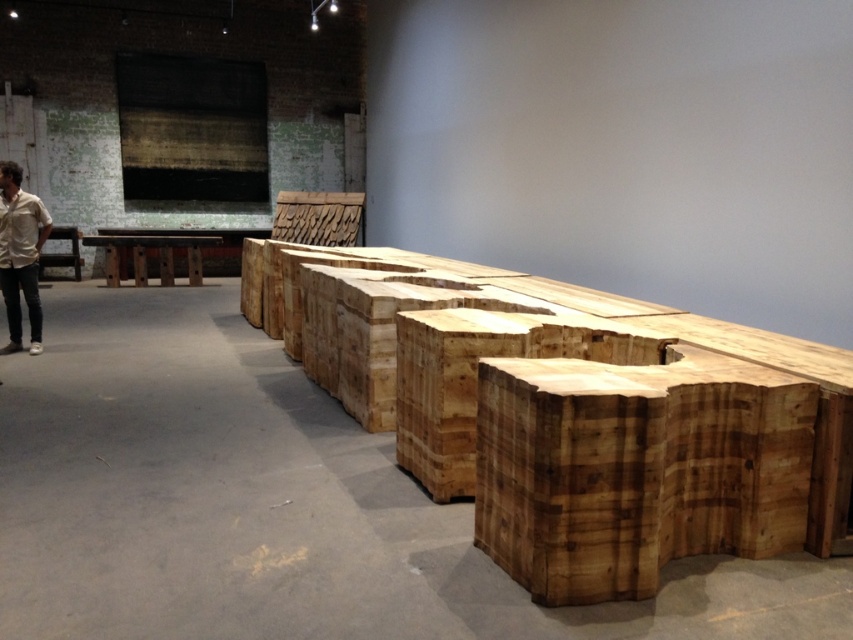
Question: Which object appears closest to the camera in this image?

Choices:
 (A) wooden bench at left
 (B) white shirt at left
 (C) natural wood table at center

Answer: (B)

Question: Is natural wood bench at center behind wooden bench at left?

Choices:
 (A) yes
 (B) no

Answer: (B)

Question: Among these objects, which one is farthest from the camera?

Choices:
 (A) natural wood bench at center
 (B) natural wood table at center
 (C) white shirt at left
 (D) wooden bench at left

Answer: (D)

Question: Is white shirt at left positioned before wooden bench at left?

Choices:
 (A) yes
 (B) no

Answer: (A)

Question: Is white shirt at left below wooden bench at left?

Choices:
 (A) yes
 (B) no

Answer: (A)

Question: Which point is closer to the camera?

Choices:
 (A) (166, 244)
 (B) (16, 202)
 (C) (357, 337)
 (D) (73, 246)

Answer: (C)